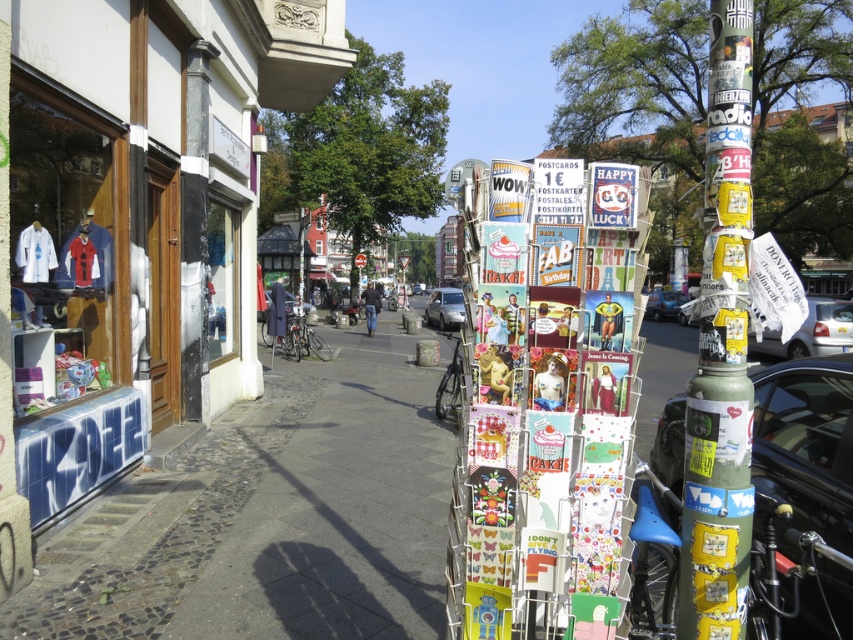
Question: Is cobblestone pavement at lower left closer to camera compared to metallic silver car at center?

Choices:
 (A) yes
 (B) no

Answer: (A)

Question: Which point is closer to the camera taking this photo?

Choices:
 (A) (804, 496)
 (B) (816, 300)

Answer: (A)

Question: Is cobblestone pavement at lower left positioned at the back of green textured pole at right?

Choices:
 (A) yes
 (B) no

Answer: (A)

Question: Based on their relative distances, which object is farther from the green textured pole at right?

Choices:
 (A) cobblestone pavement at lower left
 (B) white glossy car at right
 (C) silver metallic car at center
 (D) metallic silver car at center

Answer: (D)

Question: Considering the relative positions of white glossy car at right and silver metallic car at center in the image provided, where is white glossy car at right located with respect to silver metallic car at center?

Choices:
 (A) right
 (B) left

Answer: (A)

Question: Which point is closer to the camera taking this photo?

Choices:
 (A) (210, 572)
 (B) (677, 410)

Answer: (A)